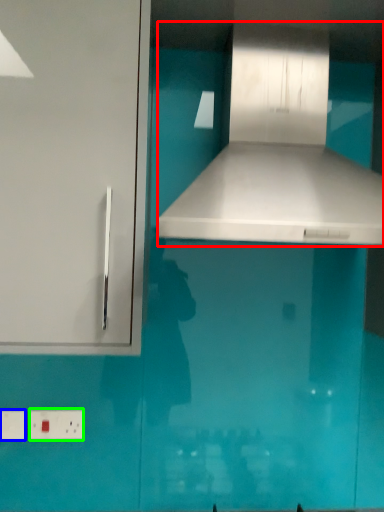
Question: Which is farther away from vent (highlighted by a red box)? electric outlet (highlighted by a blue box) or electric outlet (highlighted by a green box)?

Choices:
 (A) electric outlet
 (B) electric outlet

Answer: (A)